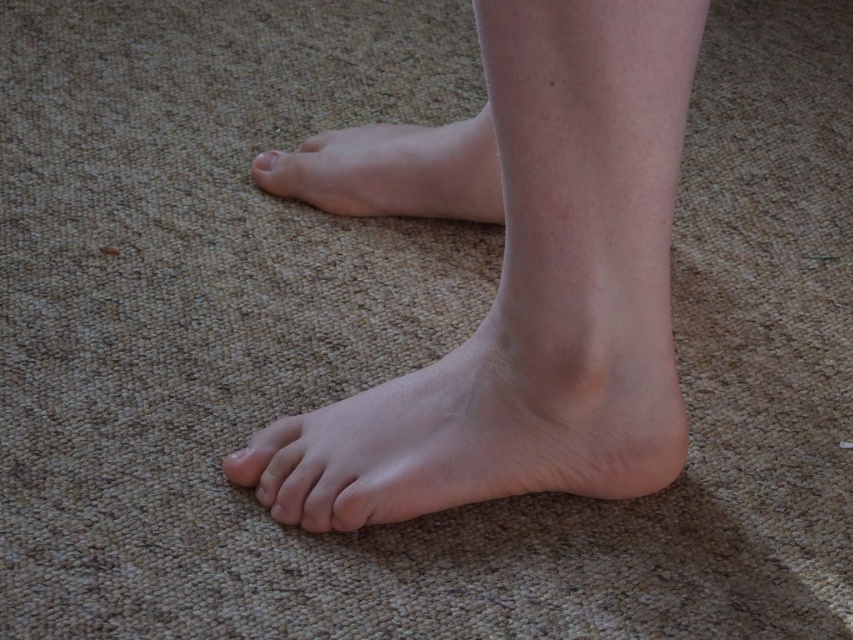
Question: Which point appears closest to the camera in this image?

Choices:
 (A) (271, 161)
 (B) (486, 371)

Answer: (B)

Question: From the image, what is the correct spatial relationship of skin-toned flesh at center in relation to smooth skin foot at lower center?

Choices:
 (A) right
 (B) left

Answer: (A)

Question: Does smooth skin foot at lower center have a lesser width compared to smooth skin foot at center?

Choices:
 (A) no
 (B) yes

Answer: (A)

Question: Which point is farther from the camera taking this photo?

Choices:
 (A) (511, 148)
 (B) (463, 202)
 (C) (259, 164)
 (D) (561, 428)

Answer: (C)

Question: Is smooth skin foot at center bigger than pale skin toe at center?

Choices:
 (A) no
 (B) yes

Answer: (B)

Question: Based on their relative distances, which object is farther from the smooth skin foot at lower center?

Choices:
 (A) pale skin toe at center
 (B) skin-toned flesh at center
 (C) smooth skin foot at center

Answer: (A)